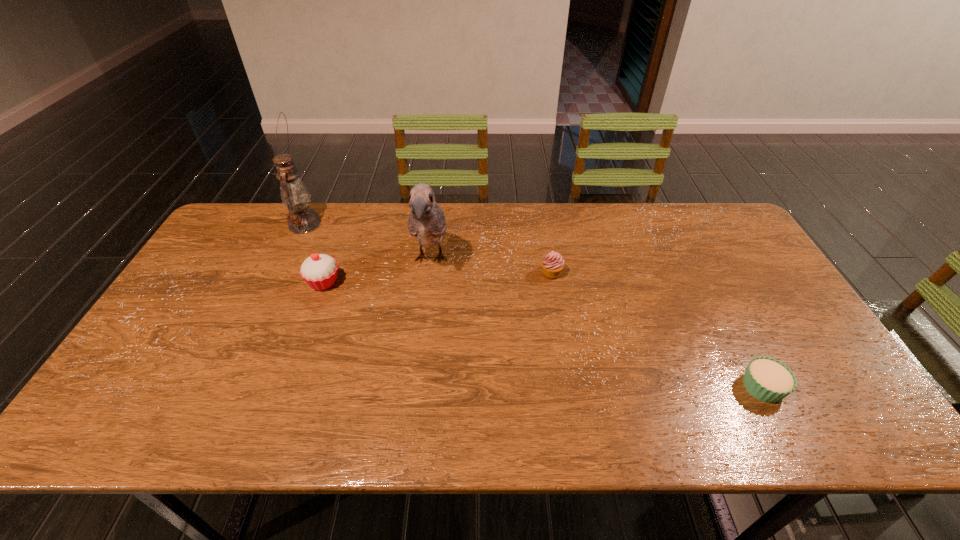
Locate an element on the screen. This screenshot has width=960, height=540. the tallest object is located at coordinates (294, 194).

I want to click on oil lamp, so coord(294,194).

Locate an element on the screen. Image resolution: width=960 pixels, height=540 pixels. parrot is located at coordinates (426, 222).

Identify the location of the second tallest object. (426, 222).

Where is `the leftmost cupcake`? the leftmost cupcake is located at coordinates (319, 271).

This screenshot has width=960, height=540. In order to click on the second object from left to right in this screenshot , I will do `click(319, 271)`.

Where is `the second cupcake from left to right`? the second cupcake from left to right is located at coordinates (553, 264).

You are a GUI agent. You are given a task and a screenshot of the screen. Output one action in this format:
    pyautogui.click(x=<x>, y=<y>)
    Task: Click on the second object from right to left
    The width and height of the screenshot is (960, 540).
    Given the screenshot: What is the action you would take?
    pyautogui.click(x=553, y=264)

Identify the location of the nearest cupcake. The image size is (960, 540). (767, 379).

This screenshot has width=960, height=540. Identify the location of the nearest object. click(x=767, y=379).